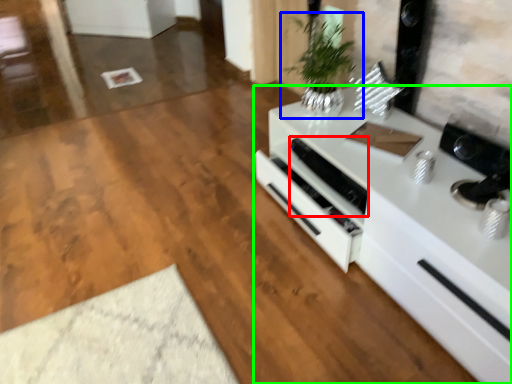
Question: Which object is the closest to the appliance (highlighted by a red box)? Choose among these: houseplant (highlighted by a blue box) or countertop (highlighted by a green box).

Choices:
 (A) houseplant
 (B) countertop

Answer: (B)